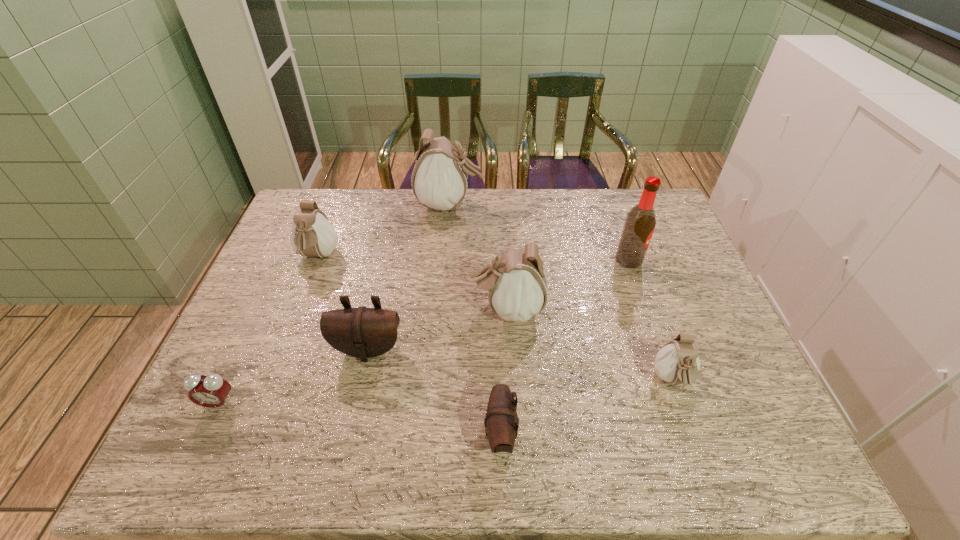
Image resolution: width=960 pixels, height=540 pixels. I want to click on beer bottle, so click(x=640, y=222).

This screenshot has width=960, height=540. What are the coordinates of `the farthest object` in the screenshot? It's located at (439, 180).

This screenshot has height=540, width=960. What are the coordinates of `the tallest pouch` in the screenshot? It's located at (439, 180).

Identify the location of the second nearest white pouch. (516, 282).

The height and width of the screenshot is (540, 960). In order to click on the third smallest white pouch in this screenshot , I will do `click(516, 282)`.

At what (x,y) coordinates should I click in order to perform the action: click on the second smallest white pouch. Please return your answer as a coordinate pair (x, y). This screenshot has height=540, width=960. Looking at the image, I should click on (312, 235).

Locate an element on the screen. the leftmost pouch is located at coordinates (312, 235).

The width and height of the screenshot is (960, 540). What are the coordinates of `the left brown pouch` in the screenshot? It's located at (362, 332).

The image size is (960, 540). Find the location of `the bigger brown pouch`. the bigger brown pouch is located at coordinates (362, 332).

Find the location of a particular element. the nearest white pouch is located at coordinates (677, 362).